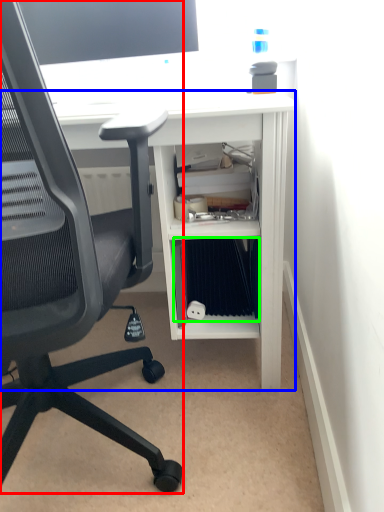
Question: Which object is positioned closest to chair (highlighted by a red box)? Select from desk (highlighted by a blue box) and binder (highlighted by a green box).

Choices:
 (A) desk
 (B) binder

Answer: (A)